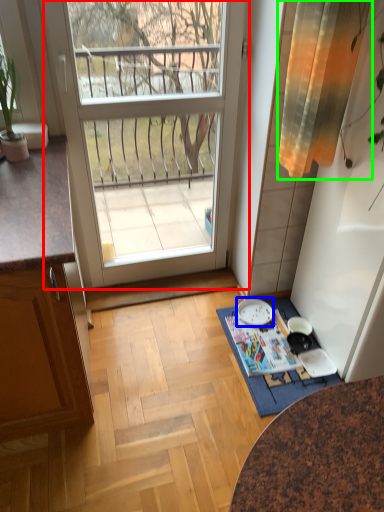
Question: Estimate the real-world distances between objects in this image. Which object is farther from door (highlighted by a red box), plate (highlighted by a blue box) or curtain (highlighted by a green box)?

Choices:
 (A) plate
 (B) curtain

Answer: (A)